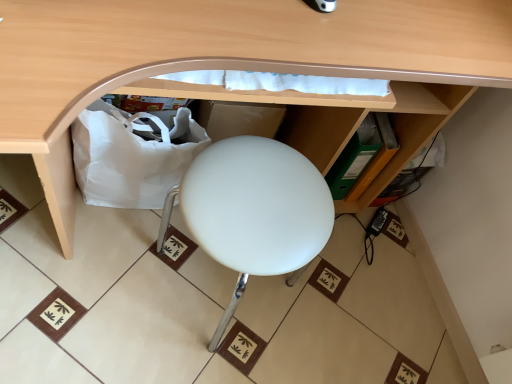
The width and height of the screenshot is (512, 384). Identify the location of free point above white matte stool at center (from a real-world perspective). pos(264,203).